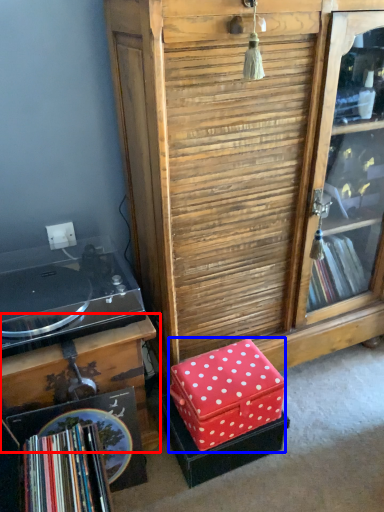
Question: Which of the following is the farthest to the observer, table (highlighted by a red box) or storage box (highlighted by a blue box)?

Choices:
 (A) table
 (B) storage box

Answer: (B)